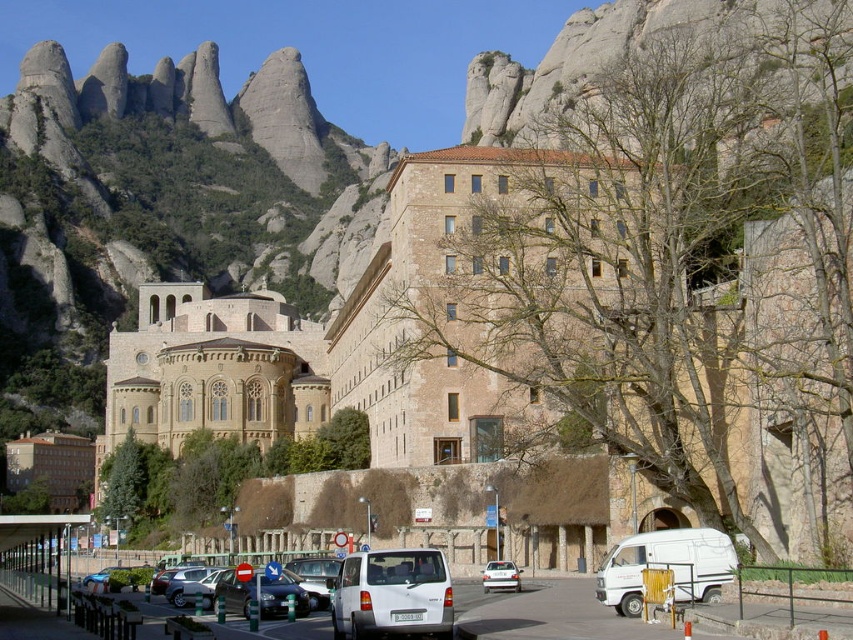
Question: Is beige stone building at center wider than shiny blue sedan at center?

Choices:
 (A) yes
 (B) no

Answer: (A)

Question: Which object appears farthest from the camera in this image?

Choices:
 (A) white matte sedan at center
 (B) beige stone building at center
 (C) shiny blue sedan at center
 (D) white matte van at lower right

Answer: (B)

Question: Does white matte van at lower right appear under metallic silver car at lower left?

Choices:
 (A) yes
 (B) no

Answer: (B)

Question: Can you confirm if beige stone building at center is positioned below white matte van at center?

Choices:
 (A) no
 (B) yes

Answer: (A)

Question: Which point is farther from the camera taking this photo?

Choices:
 (A) tap(113, 358)
 (B) tap(194, 588)

Answer: (A)

Question: Among these objects, which one is farthest from the camera?

Choices:
 (A) beige stone building at center
 (B) white matte sedan at center
 (C) metallic silver car at lower left
 (D) shiny blue sedan at center

Answer: (A)